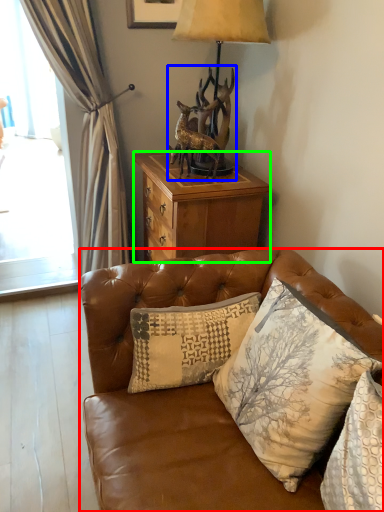
Question: Which is nearer to the studio couch (highlighted by a red box)? animal (highlighted by a blue box) or desk (highlighted by a green box).

Choices:
 (A) animal
 (B) desk

Answer: (B)